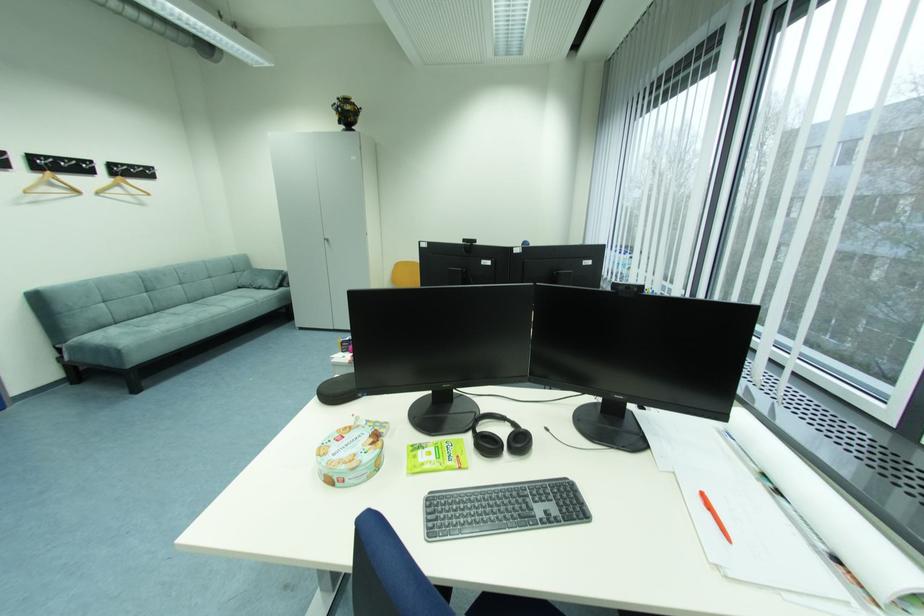
Where is `cabinet door handle`? The image size is (924, 616). cabinet door handle is located at coordinates (326, 241).